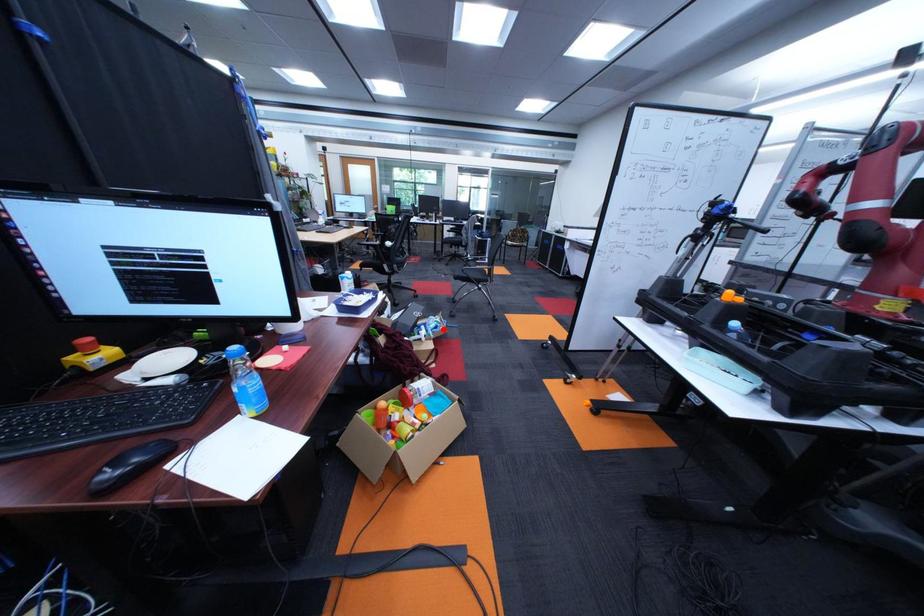
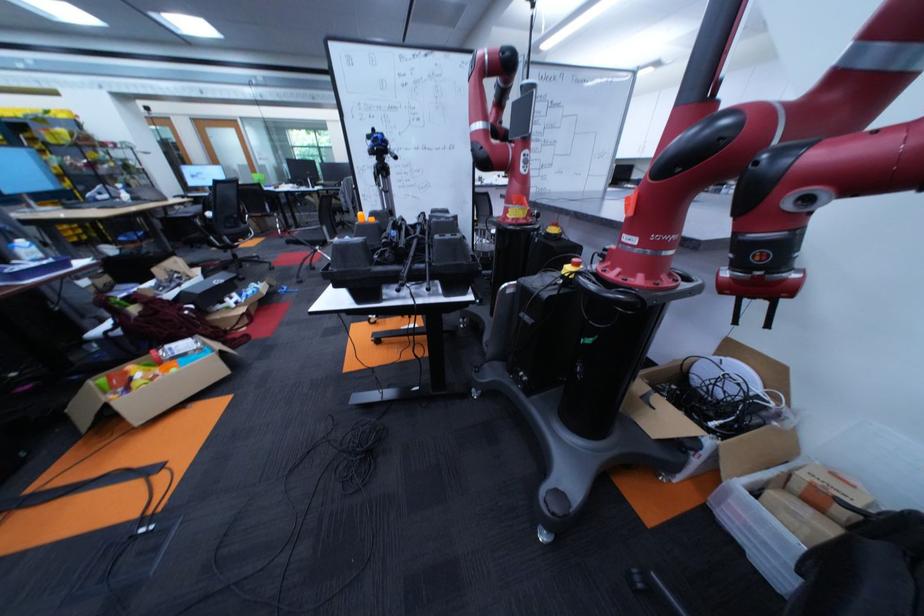
Question: I am providing you with two images of the same scene from different viewpoints. In image1, a red point is highlighted. Considering the same 3D point in image2, which of the following is correct?

Choices:
 (A) It is closer
 (B) It is farther

Answer: (A)